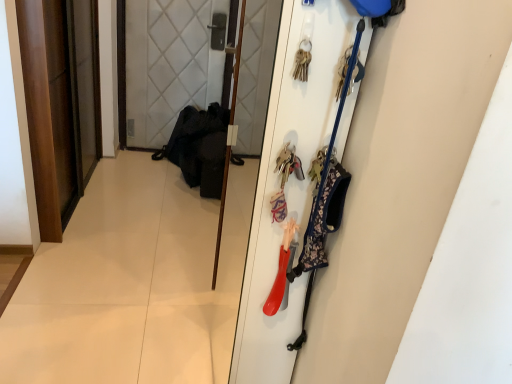
Question: Does wooden screen door at center contain wooden door at left, the first door when ordered from back to front?

Choices:
 (A) yes
 (B) no

Answer: (B)

Question: Is the depth of wooden screen door at center greater than that of wooden door at left, the 1th door in the left-to-right sequence?

Choices:
 (A) yes
 (B) no

Answer: (B)

Question: Does wooden screen door at center have a lesser width compared to wooden door at left, the 2th door from the right?

Choices:
 (A) no
 (B) yes

Answer: (B)

Question: Would you say wooden screen door at center is outside wooden door at left, the first door when ordered from back to front?

Choices:
 (A) no
 (B) yes

Answer: (B)

Question: From a real-world perspective, is wooden screen door at center positioned over wooden door at left, acting as the 2th door starting from the front, based on gravity?

Choices:
 (A) yes
 (B) no

Answer: (A)

Question: Considering the positions of wooden screen door at center and matte plastic door at right, which appears as the first door when viewed from the front, in the image, is wooden screen door at center wider or thinner than matte plastic door at right, which appears as the first door when viewed from the front,?

Choices:
 (A) wide
 (B) thin

Answer: (B)

Question: From their relative heights in the image, would you say wooden screen door at center is taller or shorter than matte plastic door at right, which appears as the first door when viewed from the front?

Choices:
 (A) tall
 (B) short

Answer: (B)

Question: Do you think wooden screen door at center is within matte plastic door at right, the first door from the right, or outside of it?

Choices:
 (A) outside
 (B) inside

Answer: (A)

Question: Is point (228, 147) positioned closer to the camera than point (387, 274)?

Choices:
 (A) closer
 (B) farther

Answer: (B)

Question: Would you say wooden door at left, acting as the 2th door starting from the front, is to the left or to the right of wooden screen door at center in the picture?

Choices:
 (A) right
 (B) left

Answer: (B)

Question: Considering the positions of wooden door at left, the 2th door from the right, and wooden screen door at center in the image, is wooden door at left, the 2th door from the right, taller or shorter than wooden screen door at center?

Choices:
 (A) short
 (B) tall

Answer: (A)

Question: Considering the positions of point (40, 34) and point (244, 6), is point (40, 34) closer or farther from the camera than point (244, 6)?

Choices:
 (A) farther
 (B) closer

Answer: (B)

Question: Based on their sizes in the image, would you say wooden door at left, the 1th door in the left-to-right sequence, is bigger or smaller than wooden screen door at center?

Choices:
 (A) small
 (B) big

Answer: (B)

Question: Considering their positions, is matte plastic door at right, the first door from the right, located in front of or behind wooden door at left, the 1th door in the left-to-right sequence?

Choices:
 (A) front
 (B) behind

Answer: (A)

Question: Considering the positions of matte plastic door at right, the second door in the back-to-front sequence, and wooden door at left, the first door when ordered from back to front, in the image, is matte plastic door at right, the second door in the back-to-front sequence, bigger or smaller than wooden door at left, the first door when ordered from back to front,?

Choices:
 (A) small
 (B) big

Answer: (B)